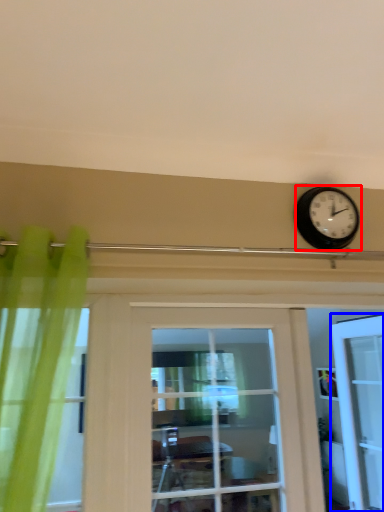
Question: Which object is further to the camera taking this photo, wall clock (highlighted by a red box) or door (highlighted by a blue box)?

Choices:
 (A) wall clock
 (B) door

Answer: (B)